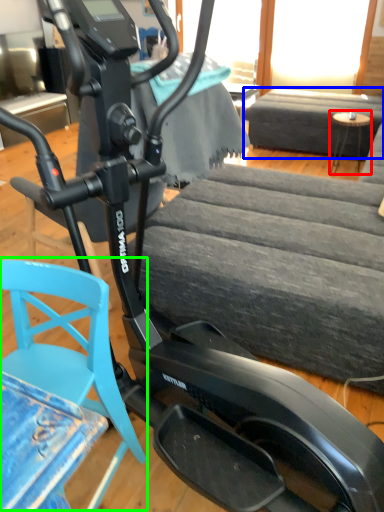
Question: Considering the real-world distances, which object is farthest from table (highlighted by a red box)? couch (highlighted by a blue box) or swivel chair (highlighted by a green box)?

Choices:
 (A) couch
 (B) swivel chair

Answer: (B)